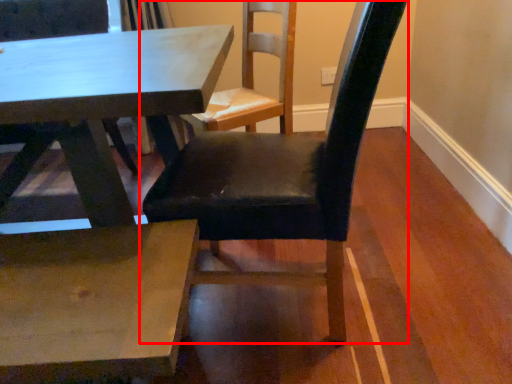
Question: From the image's perspective, where is chair (annotated by the red box) located in relation to table in the image?

Choices:
 (A) above
 (B) below

Answer: (A)